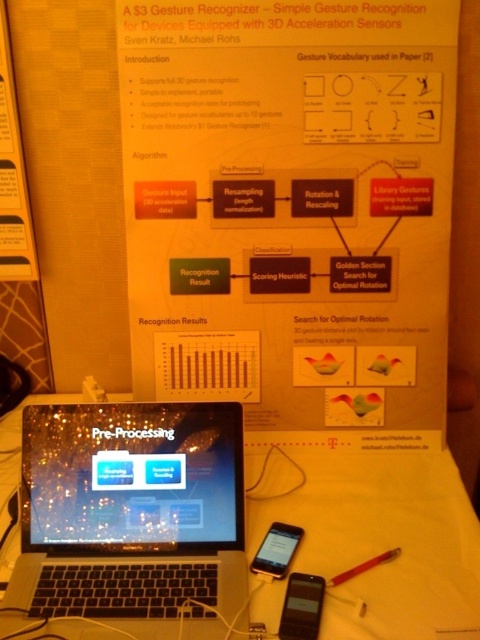
Between satin black laptop at center and matte black smartphone at lower center, which one has more height?

→ With more height is satin black laptop at center.

Is satin black laptop at center shorter than matte black smartphone at lower center?

No.

At what (x,y) coordinates should I click in order to perform the action: click on satin black laptop at center. Please return your answer as a coordinate pair (x, y). Looking at the image, I should click on (132, 518).

Identify the location of satin black laptop at center. (132, 518).

Who is higher up, white paper at upper center or matte black smartphone at lower center?

Positioned higher is white paper at upper center.

Does white paper at upper center have a lesser width compared to matte black smartphone at lower center?

No.

Find the location of a particular element. The image size is (480, 640). white paper at upper center is located at coordinates (291, 211).

This screenshot has width=480, height=640. I want to click on white paper at upper center, so click(x=291, y=211).

Does white paper at upper center appear over black matte smartphone at lower right?

Yes, white paper at upper center is above black matte smartphone at lower right.

Does point (128, 129) come closer to viewer compared to point (295, 609)?

No, (128, 129) is behind (295, 609).

Locate an element on the screen. Image resolution: width=480 pixels, height=640 pixels. white paper at upper center is located at coordinates (291, 211).